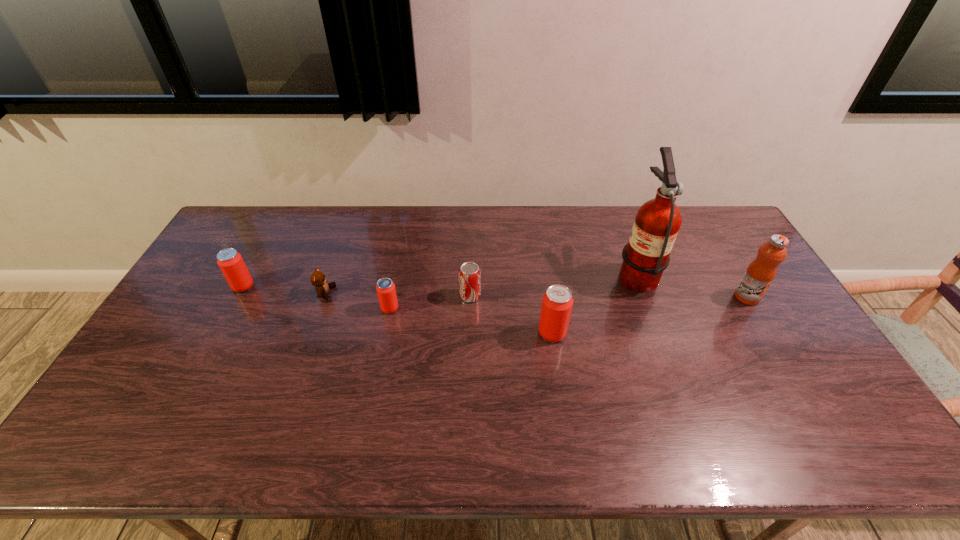
I want to click on free space between the farthest beer can and the second nearest beer can, so click(317, 298).

Where is `free spot between the fire extinguisher and the fourth object from right to left`? free spot between the fire extinguisher and the fourth object from right to left is located at coordinates (553, 285).

Where is `free spot between the leftmost object and the third object from left to right`? Image resolution: width=960 pixels, height=540 pixels. free spot between the leftmost object and the third object from left to right is located at coordinates (317, 298).

Where is `empty location between the tallest beer can and the sixth object from right to left`? This screenshot has height=540, width=960. empty location between the tallest beer can and the sixth object from right to left is located at coordinates (439, 313).

You are a GUI agent. You are given a task and a screenshot of the screen. Output one action in this format:
    pyautogui.click(x=<x>, y=<y>)
    Task: Click on the empty location between the fruit juice and the fourth object from right to left
    The width and height of the screenshot is (960, 540).
    Given the screenshot: What is the action you would take?
    pyautogui.click(x=609, y=296)

Find the location of a particular element. This screenshot has height=540, width=960. vacant point located between the sixth object from left to right and the farthest beer can is located at coordinates (440, 280).

Identify which object is the closest to the second tallest beer can. Please provide its 2D coordinates. Your answer should be formatted as a tuple, i.e. [(x, y)], where the tuple contains the x and y coordinates of a point satisfying the conditions above.

[(317, 279)]

Identify the location of object that is the nearest to the second tallest object. The height and width of the screenshot is (540, 960). (657, 222).

Identify the location of beer can identified as the second closest to the soda can. This screenshot has width=960, height=540. pos(385,288).

Select which beer can appears as the second closest to the second tallest object. Please provide its 2D coordinates. Your answer should be formatted as a tuple, i.e. [(x, y)], where the tuple contains the x and y coordinates of a point satisfying the conditions above.

[(385, 288)]